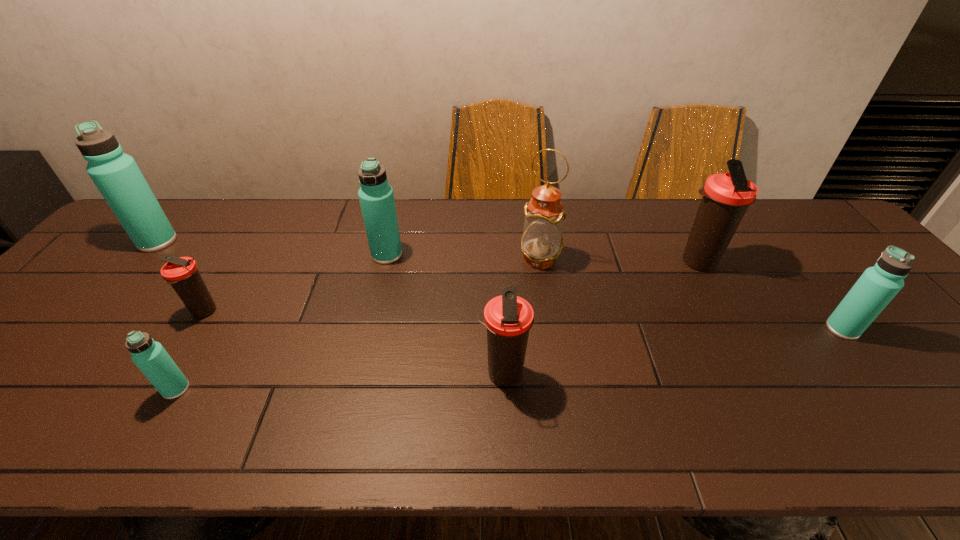
Identify which thermos bottle is located as the nearest to the rightmost aqua thermos bottle. Please provide its 2D coordinates. Your answer should be formatted as a tuple, i.e. [(x, y)], where the tuple contains the x and y coordinates of a point satisfying the conditions above.

[(726, 197)]

Identify which thermos bottle is located as the fifth nearest to the smallest aqua thermos bottle. Please provide its 2D coordinates. Your answer should be formatted as a tuple, i.e. [(x, y)], where the tuple contains the x and y coordinates of a point satisfying the conditions above.

[(726, 197)]

Identify the location of aqua thermos bottle that stands as the closest to the biggest aqua thermos bottle. 149,356.

Identify the location of aqua thermos bottle that is the second closest to the second biggest aqua thermos bottle. (116, 175).

Identify the location of brown thermos bottle that is the second closest one to the second nearest brown thermos bottle. (726, 197).

Locate an element on the screen. The height and width of the screenshot is (540, 960). brown thermos bottle object that ranks as the second closest to the nearest brown thermos bottle is located at coordinates (181, 273).

Find the location of a particular element. This screenshot has width=960, height=540. vacant space that satisfies the following two spatial constraints: 1. on the front side of the third aqua thermos bottle from left to right; 2. on the left side of the tallest thermos bottle is located at coordinates (146, 255).

Where is `vacant space that satisfies the following two spatial constraints: 1. on the front side of the sixth thermos bottle from left to right; 2. on the left side of the third aqua thermos bottle from left to right`? The image size is (960, 540). vacant space that satisfies the following two spatial constraints: 1. on the front side of the sixth thermos bottle from left to right; 2. on the left side of the third aqua thermos bottle from left to right is located at coordinates (385, 262).

Identify the location of free location that satisfies the following two spatial constraints: 1. on the back side of the fourth thermos bottle from right to left; 2. on the left side of the second aqua thermos bottle from left to right. Image resolution: width=960 pixels, height=540 pixels. (254, 255).